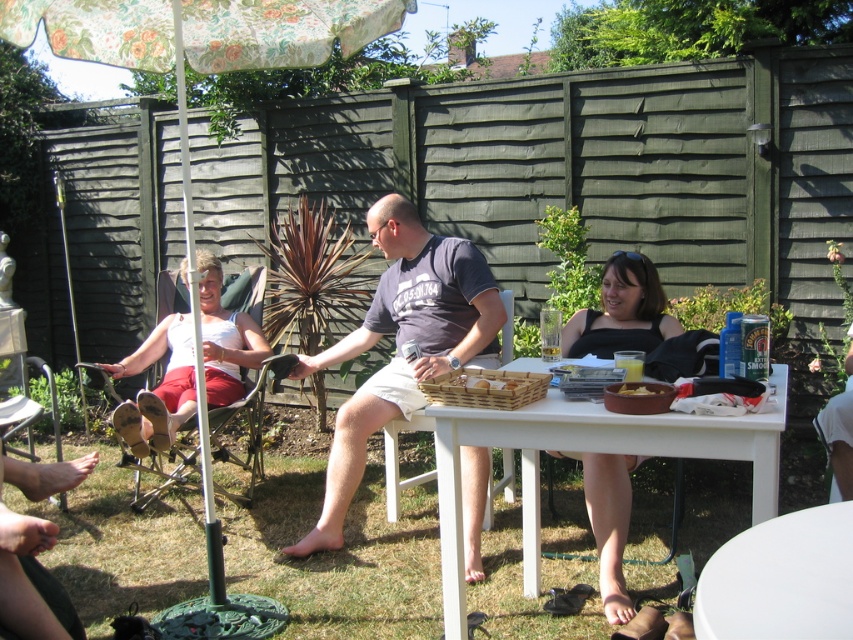
Which is above, white plastic chair at center or metallic silver chair at left?

metallic silver chair at left is higher up.

Can you confirm if white plastic chair at center is thinner than metallic silver chair at left?

Yes.

Where is `white plastic chair at center`? white plastic chair at center is located at coordinates (398, 460).

In order to click on white plastic chair at center in this screenshot , I will do `click(398, 460)`.

Is white plastic picnic table at center taller than white glossy table at lower right?

Yes, white plastic picnic table at center is taller than white glossy table at lower right.

In order to click on white plastic picnic table at center in this screenshot , I will do `click(583, 458)`.

The width and height of the screenshot is (853, 640). I want to click on white plastic picnic table at center, so click(583, 458).

Based on the photo, does black matte dress at center have a greater height compared to yellow matte bowl at lower center?

Indeed, black matte dress at center has a greater height compared to yellow matte bowl at lower center.

Based on the photo, who is positioned more to the left, black matte dress at center or yellow matte bowl at lower center?

Positioned to the left is yellow matte bowl at lower center.

What do you see at coordinates (622, 310) in the screenshot? I see `black matte dress at center` at bounding box center [622, 310].

Locate an element on the screen. This screenshot has width=853, height=640. black matte dress at center is located at coordinates 622,310.